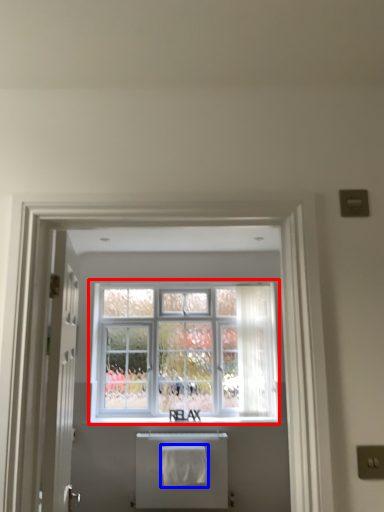
Question: Among these objects, which one is farthest to the camera, window (highlighted by a red box) or bath towel (highlighted by a blue box)?

Choices:
 (A) window
 (B) bath towel

Answer: (A)